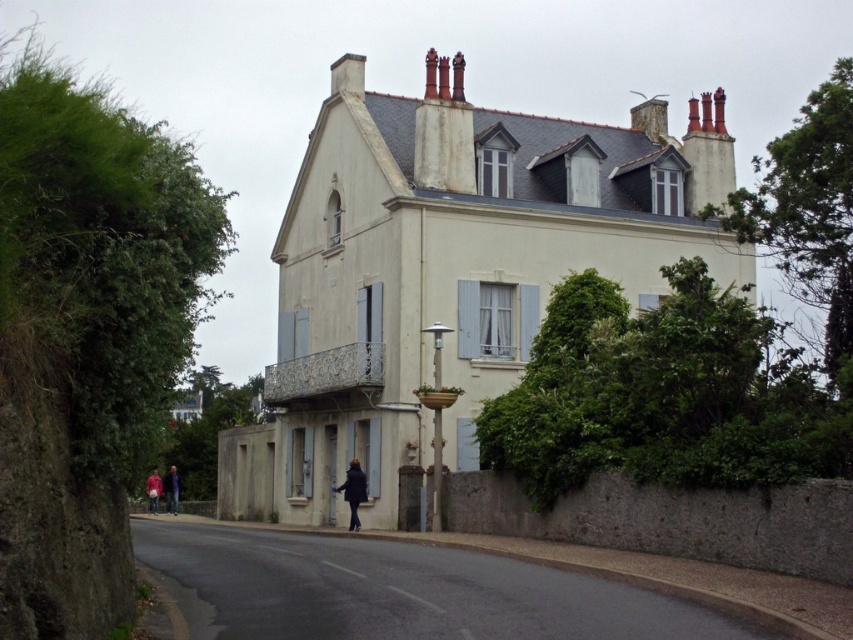
You are a delivery person standing on the paved road in front of the residential building. You need to place a package between the black matte coat at lower center and the blue fabric jacket at lower left. Where should you place it?

The black matte coat at lower center is positioned on the right side of the blue fabric jacket at lower left, so you should place the package between them on the right side of the blue fabric jacket at lower left and left side of the black matte coat at lower center.

In the scene shown: You are standing on the paved road in front of the residential building and see two jackets hanging on the low concrete wall. Which jacket is closer to the building, the blue fabric jacket at lower left or the red fabric jacket at lower left?

The red fabric jacket at lower left is closer to the building because the blue fabric jacket at lower left is positioned to its right, meaning the red jacket is nearer to the building while the blue one is further away from it.

You are standing at the entrance of the two story residential building and see two points marked on the road ahead. The first is point [357,480] and the second is point [172,477]. Which point is closer to you?

Point [357,480] is in front of point [172,477], so the closer point to you is point [357,480].